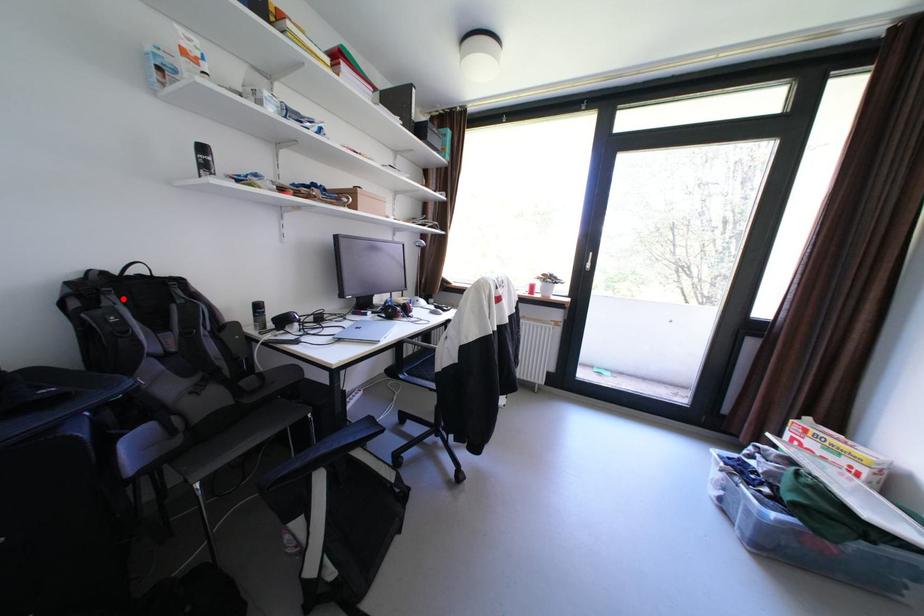
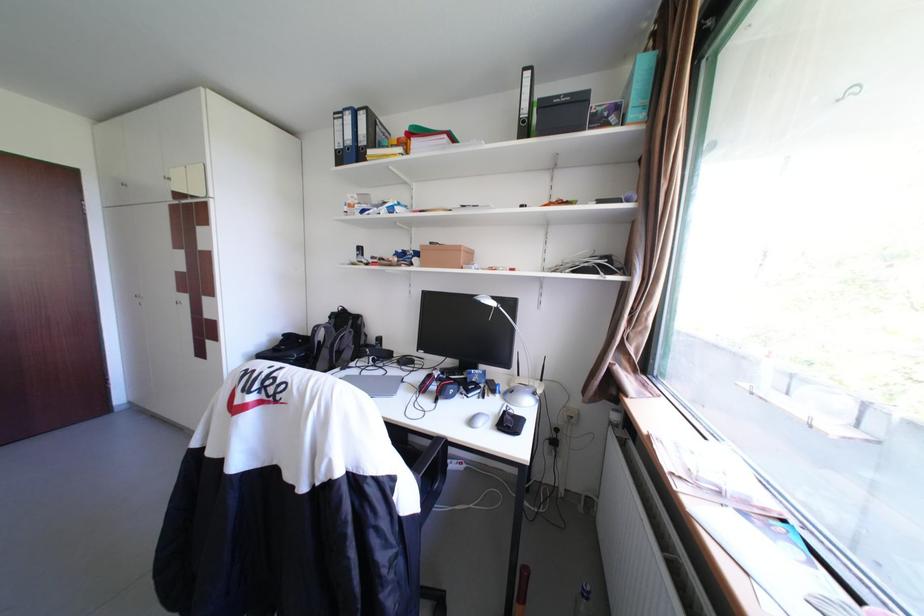
Where in the second image is the point corresponding to the highlighted location from the first image?

(344, 321)